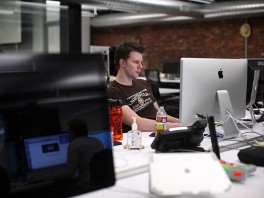
Identify the location of brick wall. (181, 35).